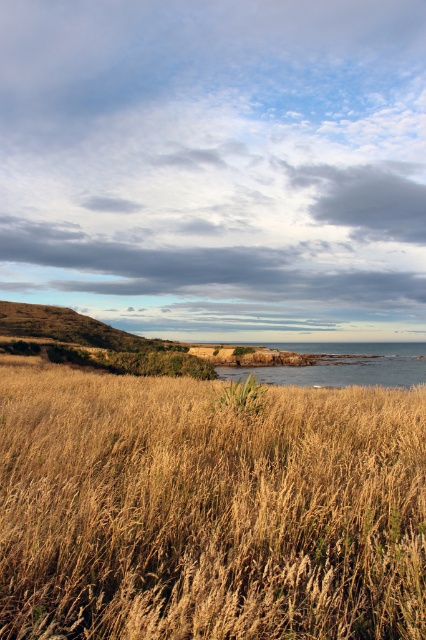
You are standing in the coastal landscape and want to pick a weed. You see both the dry grass at center and the green grassy weed at center. Which one is easier to reach without moving your feet?

The dry grass at center is closer to the viewer than the green grassy weed at center, so it is easier to reach without moving your feet.

You are standing at the point marked by the coordinates point (203,628) in the coastal landscape. A seagull flies directly towards you at a constant speed of 10 feet per second. How many seconds will it take for the seagull to reach you?

The point point (203,628) is 8.48 feet away from the viewer. The seagull flying at 10 feet per second will take approximately 0.85 seconds to reach the point point (203,628).

From the picture: You are a photographer planning to capture the coastal landscape. You want to ensure both the dry grass at center and the blue water at center are visible in your shot. Which object will occupy a larger portion of the frame?

The blue water at center occupies a larger portion of the frame because it is bigger than the dry grass at center.